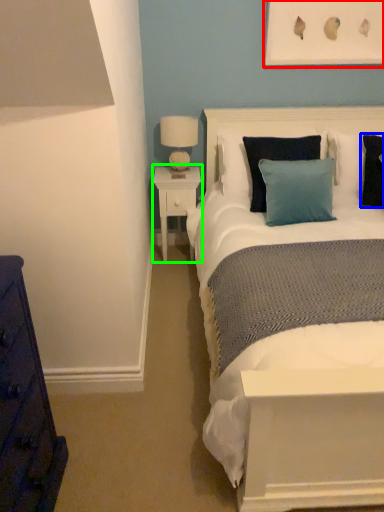
Question: Which object is the farthest from picture frame (highlighted by a red box)? Choose among these: pillow (highlighted by a blue box) or nightstand (highlighted by a green box).

Choices:
 (A) pillow
 (B) nightstand

Answer: (B)